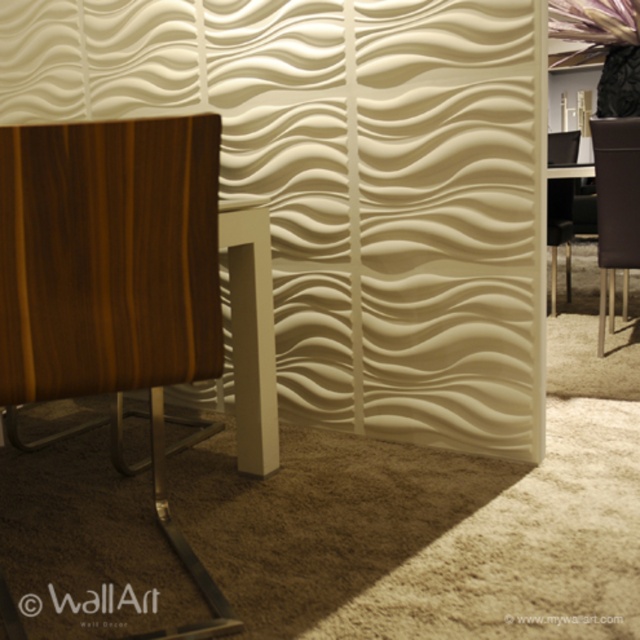
You are a delivery person trying to place a new sofa that is 1.5 meters wide in the space between the brown leather chair at right and the black leather chair at right. Can the sofa fit there?

The distance between the brown leather chair at right and the black leather chair at right is 77.36 centimeters. Since the sofa is 1.5 meters wide, which is 150 centimeters, the sofa cannot fit in the available space.

You are sitting in the living room and see two chairs at the right side of the room. Which chair is positioned lower in height between the brown leather chair at right and the black leather chair at right?

The brown leather chair at right is positioned below the black leather chair at right, so it is lower in height.

You are standing in the center of the room and see the brown leather chair at right and the black leather chair at right. Which chair is closer to the wall with the textured wave pattern?

The brown leather chair at right is closer to the wall with the textured wave pattern because it is positioned to the left of the black leather chair at right, which is further away from the wall.